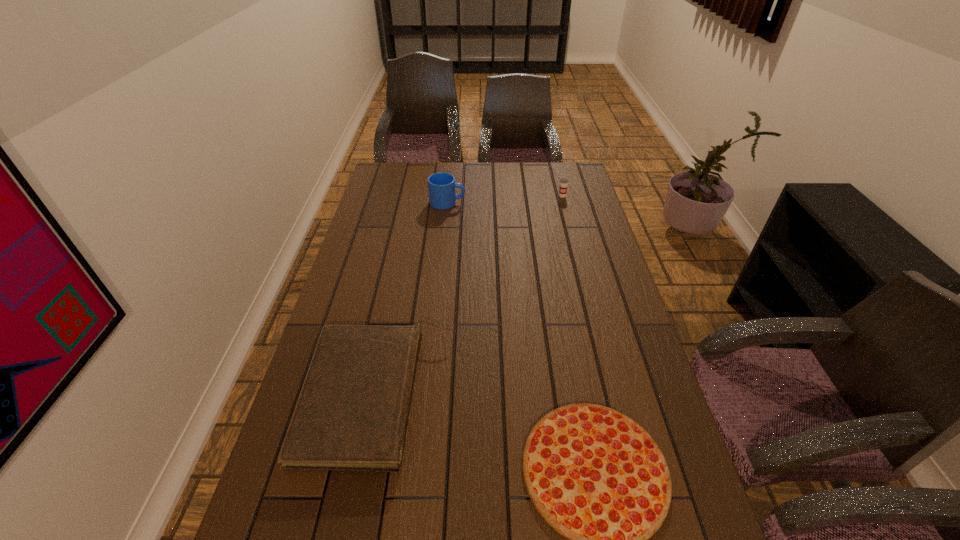
I want to click on mug, so click(x=441, y=186).

The height and width of the screenshot is (540, 960). In order to click on cup in this screenshot , I will do `click(563, 182)`.

Where is `paperback book`? paperback book is located at coordinates (352, 413).

Find the location of a particular element. free space located 0.270m on the side of the mug with the handle is located at coordinates (533, 202).

Where is `free space located 0.150m on the side of the cup with the logo`? This screenshot has width=960, height=540. free space located 0.150m on the side of the cup with the logo is located at coordinates (568, 219).

Locate an element on the screen. The image size is (960, 540). vacant space located on the spine side of the paperback book is located at coordinates (509, 395).

You are a GUI agent. You are given a task and a screenshot of the screen. Output one action in this format:
    pyautogui.click(x=<x>, y=<y>)
    Task: Click on the object that is positioned at the left edge
    
    Given the screenshot: What is the action you would take?
    pyautogui.click(x=352, y=413)

You are a GUI agent. You are given a task and a screenshot of the screen. Output one action in this format:
    pyautogui.click(x=<x>, y=<y>)
    Task: Click on the object situated at the right edge
    
    Given the screenshot: What is the action you would take?
    pyautogui.click(x=563, y=182)

The width and height of the screenshot is (960, 540). I want to click on free region at the far edge of the desktop, so click(522, 165).

In the image, there is a desktop. Where is `free region at the left edge`? The height and width of the screenshot is (540, 960). free region at the left edge is located at coordinates (x=385, y=280).